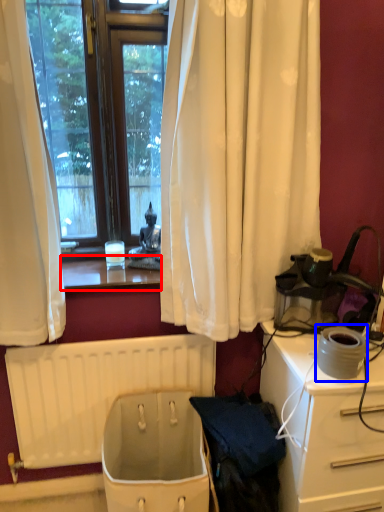
Question: Which of the following is the farthest to the observer, window sill (highlighted by a red box) or appliance (highlighted by a blue box)?

Choices:
 (A) window sill
 (B) appliance

Answer: (A)